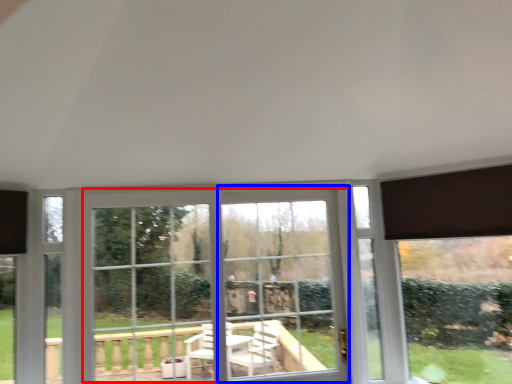
Question: Which object is further to the camera taking this photo, bay window (highlighted by a red box) or window frame (highlighted by a blue box)?

Choices:
 (A) bay window
 (B) window frame

Answer: (B)